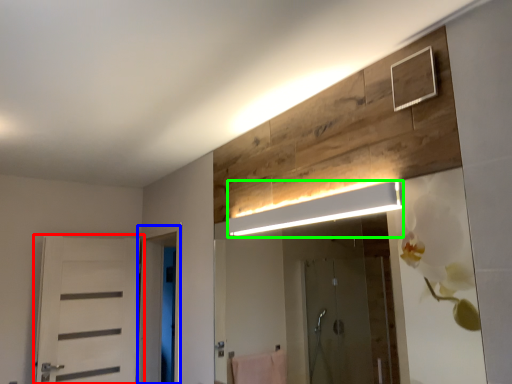
Question: Which object is positioned closest to door (highlighted by a red box)? Select from screen door (highlighted by a blue box) and light fixture (highlighted by a green box).

Choices:
 (A) screen door
 (B) light fixture

Answer: (A)